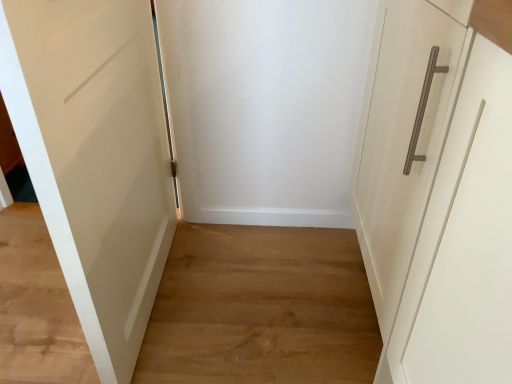
At what (x,y) coordinates should I click in order to perform the action: click on empty space that is to the right of white matte door at left. Please return your answer as a coordinate pair (x, y). The width and height of the screenshot is (512, 384). Looking at the image, I should click on (257, 290).